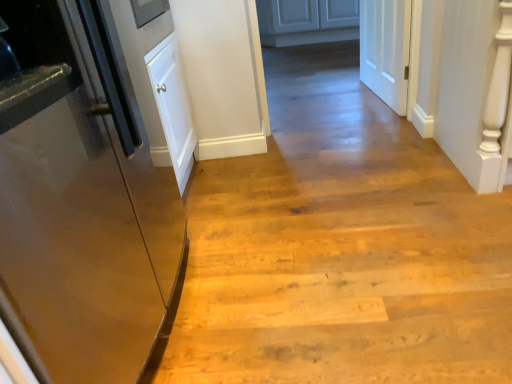
What do you see at coordinates (386, 50) in the screenshot? I see `white matte door at upper right, the 1th door when ordered from right to left` at bounding box center [386, 50].

The height and width of the screenshot is (384, 512). What are the coordinates of `matte white cabinets at center` in the screenshot? It's located at (307, 21).

Image resolution: width=512 pixels, height=384 pixels. I want to click on white matte door at upper right, the first door from the top, so click(386, 50).

Looking at this image, from a real-world perspective, is glossy metallic refrigerator at left, marked as the first door in a front-to-back arrangement, positioned above or below matte white cabinets at center?

In terms of real-world spatial position, glossy metallic refrigerator at left, marked as the first door in a front-to-back arrangement, is above matte white cabinets at center.

Is glossy metallic refrigerator at left, which is the 2th door from back to front, positioned beyond the bounds of matte white cabinets at center?

Yes, glossy metallic refrigerator at left, which is the 2th door from back to front, is not within matte white cabinets at center.

Which of these two, glossy metallic refrigerator at left, the 1th door positioned from the bottom, or matte white cabinets at center, is bigger?

glossy metallic refrigerator at left, the 1th door positioned from the bottom.

From the picture: How much distance is there between glossy metallic refrigerator at left, which is the 2th door from back to front, and matte white cabinets at center?

glossy metallic refrigerator at left, which is the 2th door from back to front, and matte white cabinets at center are 3.55 meters apart from each other.

Does point (315, 13) come closer to viewer compared to point (388, 29)?

No, it is not.

Is matte white cabinets at center surrounding white matte door at upper right, which is the second door from bottom to top?

No, white matte door at upper right, which is the second door from bottom to top, is not surrounded by matte white cabinets at center.

In the scene shown: Considering the relative positions of matte white cabinets at center and white matte door at upper right, arranged as the second door when viewed from the front, in the image provided, is matte white cabinets at center to the right of white matte door at upper right, arranged as the second door when viewed from the front, from the viewer's perspective?

No.

Is matte white cabinets at center oriented towards white matte door at upper right, which appears as the 1th door when viewed from the back?

Yes, matte white cabinets at center is turned towards white matte door at upper right, which appears as the 1th door when viewed from the back.

Would you say matte white cabinets at center is part of white matte door at upper right, which appears as the 1th door when viewed from the back,'s contents?

No, matte white cabinets at center is not a part of white matte door at upper right, which appears as the 1th door when viewed from the back.

How much distance is there between white matte door at upper right, the first door from the top, and matte white cabinets at center?

5.96 feet.

In the scene shown: Can you tell me how much white matte door at upper right, the 1th door when ordered from right to left, and matte white cabinets at center differ in facing direction?

73.8 degrees separate the facing orientations of white matte door at upper right, the 1th door when ordered from right to left, and matte white cabinets at center.

Consider the image. Which object is further away from the camera, white matte door at upper right, which is the 2th door from left to right, or matte white cabinets at center?

matte white cabinets at center is further from the camera.

Looking at this image, can you confirm if white matte door at upper right, which is the 2th door from left to right, is wider than glossy metallic refrigerator at left, marked as the first door in a front-to-back arrangement?

No.

Could you measure the distance between white matte door at upper right, which appears as the 1th door when viewed from the back, and glossy metallic refrigerator at left, marked as the second door in a top-to-bottom arrangement?

white matte door at upper right, which appears as the 1th door when viewed from the back, is 5.88 feet away from glossy metallic refrigerator at left, marked as the second door in a top-to-bottom arrangement.

Is white matte door at upper right, which is the second door from bottom to top, facing towards glossy metallic refrigerator at left, marked as the first door in a front-to-back arrangement?

No, white matte door at upper right, which is the second door from bottom to top, is not aimed at glossy metallic refrigerator at left, marked as the first door in a front-to-back arrangement.

From a real-world perspective, which object rests below the other?

In real-world perspective, white matte door at upper right, which is the 2th door from left to right, is lower.

Between matte white cabinets at center and glossy metallic refrigerator at left, the second door in the right-to-left sequence, which one is positioned in front?

glossy metallic refrigerator at left, the second door in the right-to-left sequence, is more forward.

From their relative heights in the image, would you say matte white cabinets at center is taller or shorter than glossy metallic refrigerator at left, the 1th door positioned from the bottom?

In the image, matte white cabinets at center appears to be shorter than glossy metallic refrigerator at left, the 1th door positioned from the bottom.

Do you think matte white cabinets at center is within glossy metallic refrigerator at left, which ranks as the 1th door in left-to-right order, or outside of it?

matte white cabinets at center cannot be found inside glossy metallic refrigerator at left, which ranks as the 1th door in left-to-right order.

Could you tell me if glossy metallic refrigerator at left, the second door in the right-to-left sequence, is facing white matte door at upper right, which is the 2th door from left to right?

No, glossy metallic refrigerator at left, the second door in the right-to-left sequence, is not facing towards white matte door at upper right, which is the 2th door from left to right.

Image resolution: width=512 pixels, height=384 pixels. What are the coordinates of `door located behind the glossy metallic refrigerator at left, the 1th door positioned from the bottom` in the screenshot? It's located at (386, 50).

In the scene shown: From the image's perspective, which is above, glossy metallic refrigerator at left, which is the 2th door from back to front, or white matte door at upper right, the 1th door when ordered from right to left?

white matte door at upper right, the 1th door when ordered from right to left, appears higher in the image.

Which object is closer to the camera, glossy metallic refrigerator at left, the second door in the right-to-left sequence, or white matte door at upper right, arranged as the second door when viewed from the front?

Positioned in front is glossy metallic refrigerator at left, the second door in the right-to-left sequence.

You are a GUI agent. You are given a task and a screenshot of the screen. Output one action in this format:
    pyautogui.click(x=<x>, y=<y>)
    Task: Click on the door that is the 2nd object located below the matte white cabinets at center (from the image's perspective)
    The width and height of the screenshot is (512, 384).
    Given the screenshot: What is the action you would take?
    pyautogui.click(x=79, y=198)

At what (x,y) coordinates should I click in order to perform the action: click on cabinetry located behind the white matte door at upper right, arranged as the second door when viewed from the front. Please return your answer as a coordinate pair (x, y). The height and width of the screenshot is (384, 512). Looking at the image, I should click on (307, 21).

From the image, which object appears to be nearer to matte white cabinets at center, glossy metallic refrigerator at left, the 1th door positioned from the bottom, or white matte door at upper right, which is the second door from bottom to top?

white matte door at upper right, which is the second door from bottom to top.

Which object lies further to the anchor point glossy metallic refrigerator at left, which ranks as the 1th door in left-to-right order, white matte door at upper right, which appears as the 1th door when viewed from the back, or matte white cabinets at center?

Among the two, matte white cabinets at center is located further to glossy metallic refrigerator at left, which ranks as the 1th door in left-to-right order.

From the picture: When comparing their distances from white matte door at upper right, arranged as the second door when viewed from the front, does matte white cabinets at center or glossy metallic refrigerator at left, which ranks as the 1th door in left-to-right order, seem closer?

glossy metallic refrigerator at left, which ranks as the 1th door in left-to-right order, is closer to white matte door at upper right, arranged as the second door when viewed from the front.

Which object lies further to the anchor point glossy metallic refrigerator at left, marked as the second door in a top-to-bottom arrangement, matte white cabinets at center or white matte door at upper right, arranged as the second door when viewed from the front?

Based on the image, matte white cabinets at center appears to be further to glossy metallic refrigerator at left, marked as the second door in a top-to-bottom arrangement.

Estimate the real-world distances between objects in this image. Which object is closer to matte white cabinets at center, white matte door at upper right, the 1th door when ordered from right to left, or glossy metallic refrigerator at left, the second door in the right-to-left sequence?

white matte door at upper right, the 1th door when ordered from right to left.

Based on their spatial positions, is glossy metallic refrigerator at left, which ranks as the 1th door in left-to-right order, or matte white cabinets at center further from white matte door at upper right, arranged as the second door when viewed from the front?

Based on the image, matte white cabinets at center appears to be further to white matte door at upper right, arranged as the second door when viewed from the front.

Find the location of a particular element. door between glossy metallic refrigerator at left, the 1th door positioned from the bottom, and matte white cabinets at center, along the z-axis is located at coordinates (386, 50).